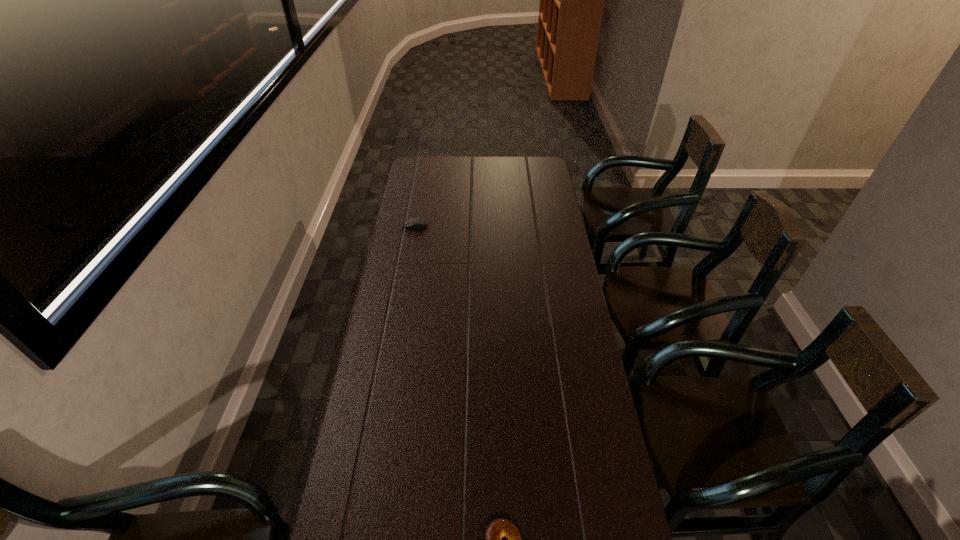
The height and width of the screenshot is (540, 960). Find the location of `the farther object`. the farther object is located at coordinates (417, 222).

Locate an element on the screen. This screenshot has width=960, height=540. computer equipment is located at coordinates (417, 222).

Image resolution: width=960 pixels, height=540 pixels. In order to click on free space located on the front of the left object in this screenshot , I will do `click(410, 257)`.

At what (x,y) coordinates should I click in order to perform the action: click on object positioned at the left edge. Please return your answer as a coordinate pair (x, y). Image resolution: width=960 pixels, height=540 pixels. Looking at the image, I should click on (417, 222).

Where is `vacant area at the far edge of the desktop`? vacant area at the far edge of the desktop is located at coordinates (471, 168).

The image size is (960, 540). In the image, there is a desktop. Identify the location of free space at the left edge. (420, 187).

The image size is (960, 540). Find the location of `free space at the right edge of the desktop`. free space at the right edge of the desktop is located at coordinates (522, 187).